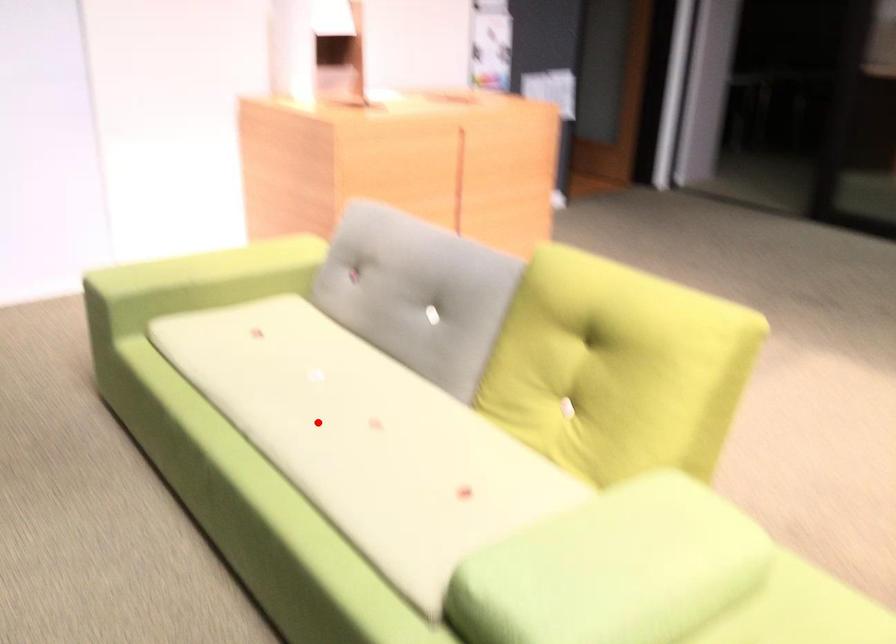
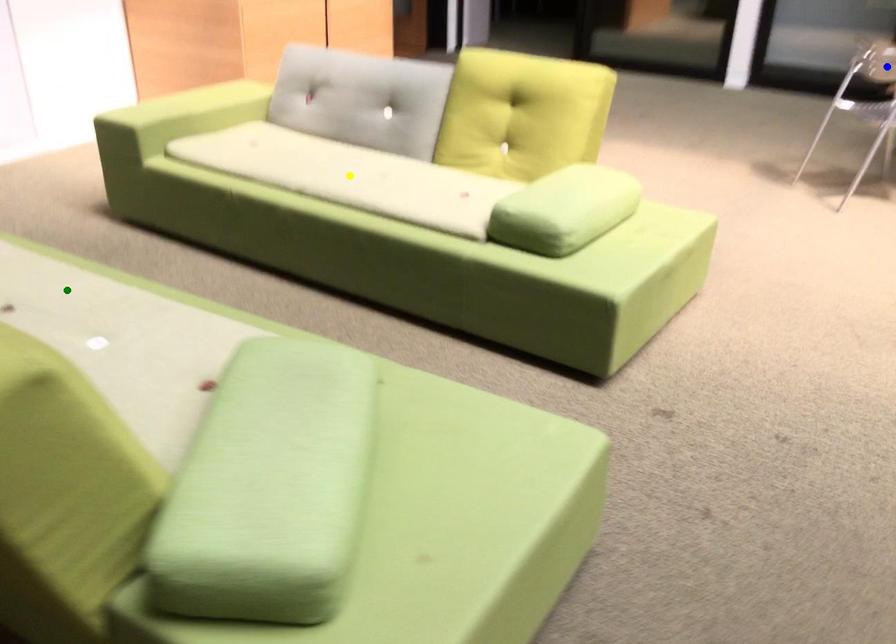
Question: I am providing you with two images of the same scene from different viewpoints. A red point is marked on the first image. You are given multiple points on the second image. Which point in image 2 represents the same 3d spot as the red point in image 1?

Choices:
 (A) green point
 (B) yellow point
 (C) blue point

Answer: (B)